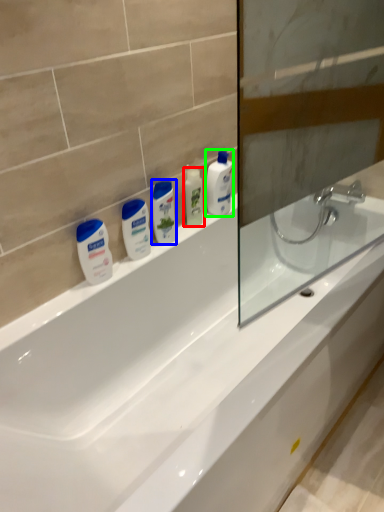
Question: Which is nearer to the mouthwash (highlighted by a red box)? mouthwash (highlighted by a blue box) or cleaning product (highlighted by a green box).

Choices:
 (A) mouthwash
 (B) cleaning product

Answer: (B)